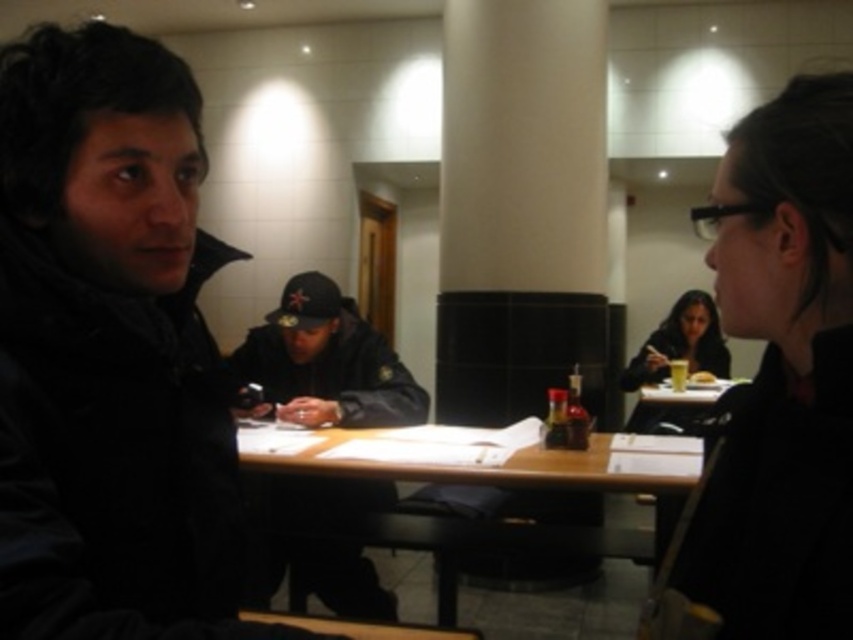
You are a photographer trying to capture both the black matte jacket at left and the black matte jacket at upper right in the same frame. Which jacket should you position closer to the camera to ensure both are fully visible?

The black matte jacket at left is positioned on the left side of black matte jacket at upper right, so you should position the black matte jacket at upper right closer to the camera to ensure both are fully visible.

You are a server in a dimly lit cafe and need to place a large tray of drinks on the wooden table at center without it touching the matte black jacket at lower right. Can you fit the tray on the table without overlapping the jacket?

The wooden table at center is wider than the matte black jacket at lower right, so yes, the tray can be placed on the wooden table at center without overlapping the matte black jacket at lower right.

Where is the black matte jacket at left located in the image?

The black matte jacket at left is located at point coordinates of (109, 353).